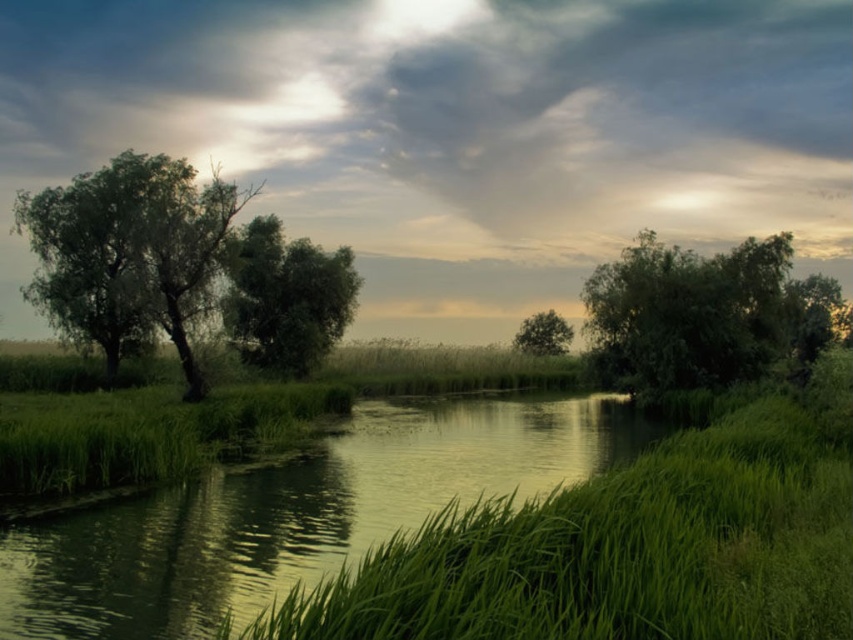
Question: Which of the following is the closest to the observer?

Choices:
 (A) (547, 330)
 (B) (305, 268)
 (C) (271, 113)
 (D) (630, 333)

Answer: (D)

Question: Observing the image, what is the correct spatial positioning of green leafy tree at center in reference to green matte tree at center?

Choices:
 (A) right
 (B) left

Answer: (B)

Question: Where is green leafy tree at left located in relation to green leafy tree at center in the image?

Choices:
 (A) left
 (B) right

Answer: (A)

Question: Is green grass at center to the right of green leafy tree at left from the viewer's perspective?

Choices:
 (A) yes
 (B) no

Answer: (A)

Question: Which of the following is the closest to the observer?

Choices:
 (A) green leafy tree at center
 (B) green grass at center
 (C) green leafy tree at right
 (D) green leafy tree at left

Answer: (B)

Question: Which of the following is the closest to the observer?

Choices:
 (A) (138, 177)
 (B) (289, 300)

Answer: (A)